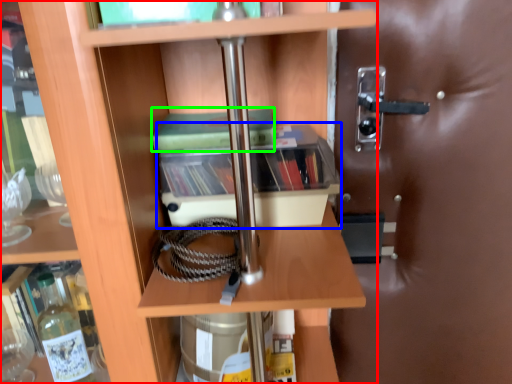
Question: Estimate the real-world distances between objects in this image. Which object is closer to shelf (highlighted by a red box), cabinetry (highlighted by a blue box) or paperback book (highlighted by a green box)?

Choices:
 (A) cabinetry
 (B) paperback book

Answer: (A)